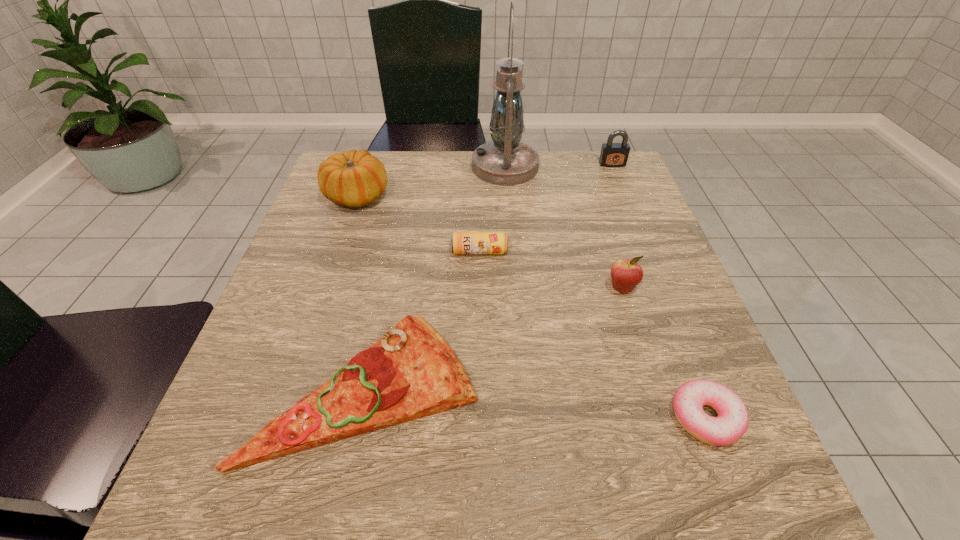
At what (x,y) coordinates should I click in order to perform the action: click on vacant space at the far right corner of the desktop. Please return your answer as a coordinate pair (x, y). Looking at the image, I should click on (627, 176).

Where is `free space between the pizza and the apple`? Image resolution: width=960 pixels, height=540 pixels. free space between the pizza and the apple is located at coordinates (494, 338).

I want to click on vacant region between the third nearest object and the pizza, so click(x=494, y=338).

This screenshot has width=960, height=540. Identify the location of free area in between the oil lamp and the apple. (564, 227).

The image size is (960, 540). In order to click on vacant area that lies between the oil lamp and the doughnut in this screenshot , I will do `click(606, 293)`.

Where is `vacant space that's between the beer can and the doughnut`? This screenshot has height=540, width=960. vacant space that's between the beer can and the doughnut is located at coordinates (592, 335).

Where is `free space between the doughnut and the padlock`? The height and width of the screenshot is (540, 960). free space between the doughnut and the padlock is located at coordinates (659, 291).

At what (x,y) coordinates should I click in order to perform the action: click on vacant point located between the gourd and the doughnut. Please return your answer as a coordinate pair (x, y). This screenshot has height=540, width=960. Looking at the image, I should click on (531, 307).

Find the location of `vacant space that is in between the oil lamp and the pizza`. vacant space that is in between the oil lamp and the pizza is located at coordinates (436, 278).

This screenshot has width=960, height=540. Find the location of `free space between the gourd and the doughnut`. free space between the gourd and the doughnut is located at coordinates (531, 307).